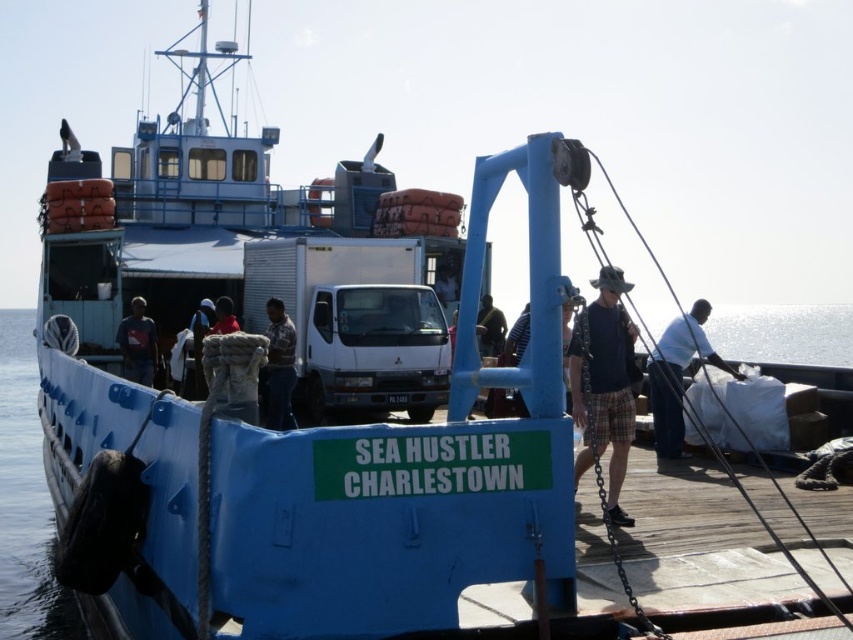
Question: Which of these objects is positioned closest to the white fabric bag at right?

Choices:
 (A) light brown leather jacket at center
 (B) green fabric shirt at center

Answer: (A)

Question: Estimate the real-world distances between objects in this image. Which object is closer to the white fabric bag at right?

Choices:
 (A) dark blue jeans at left
 (B) plaid shirt at center
 (C) light brown leather jacket at center

Answer: (B)

Question: Which of the following is the farthest from the observer?

Choices:
 (A) dark blue plaid shorts at center
 (B) transparent blue water at lower left
 (C) white fabric bag at right
 (D) plaid shirt at center

Answer: (D)

Question: Where is dark blue jeans at left located in relation to light brown leather jacket at center in the image?

Choices:
 (A) left
 (B) right

Answer: (A)

Question: Does white fabric bag at right appear under green fabric shirt at center?

Choices:
 (A) yes
 (B) no

Answer: (B)

Question: From the image, what is the correct spatial relationship of transparent blue water at lower left in relation to white fabric bag at right?

Choices:
 (A) below
 (B) above

Answer: (A)